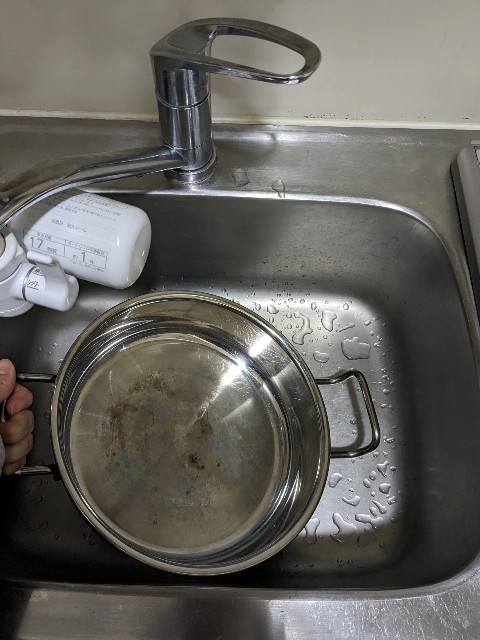
Locate an element on the screen. This screenshot has height=640, width=480. handle is located at coordinates tap(208, 63).